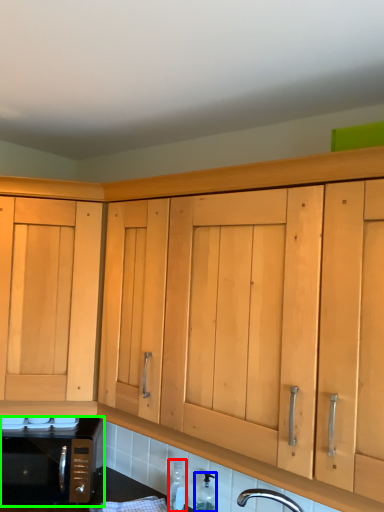
Question: Which object is positioned farthest from bottle (highlighted by a red box)? Select from bottle (highlighted by a blue box) and microwave oven (highlighted by a green box).

Choices:
 (A) bottle
 (B) microwave oven

Answer: (B)